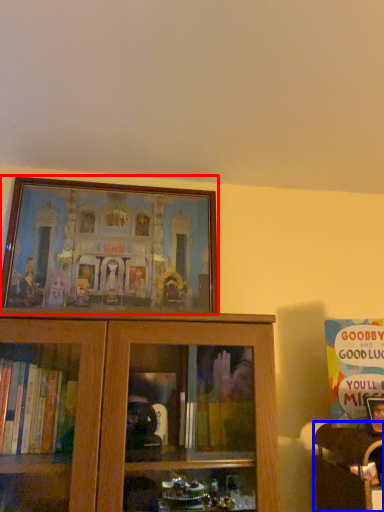
Question: Which point is further to the camera, picture frame (highlighted by a red box) or furniture (highlighted by a blue box)?

Choices:
 (A) picture frame
 (B) furniture

Answer: (A)